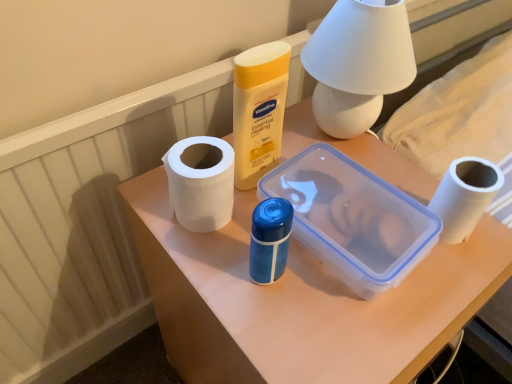
Question: Considering the positions of point (457, 173) and point (126, 246), is point (457, 173) closer or farther from the camera than point (126, 246)?

Choices:
 (A) closer
 (B) farther

Answer: (A)

Question: In terms of size, does white matte toilet paper at right appear bigger or smaller than white textured radiator at lower left?

Choices:
 (A) small
 (B) big

Answer: (A)

Question: Estimate the real-world distances between objects in this image. Which object is farther from the white textured radiator at lower left?

Choices:
 (A) white matte toilet paper at right
 (B) white matte paper towel at center-left
 (C) white matte table lamp at upper center
 (D) white matte plastic container at center

Answer: (A)

Question: Which of these objects is positioned farthest from the white matte paper towel at center-left?

Choices:
 (A) white matte table lamp at upper center
 (B) white textured radiator at lower left
 (C) white matte toilet paper at right
 (D) white matte plastic container at center

Answer: (B)